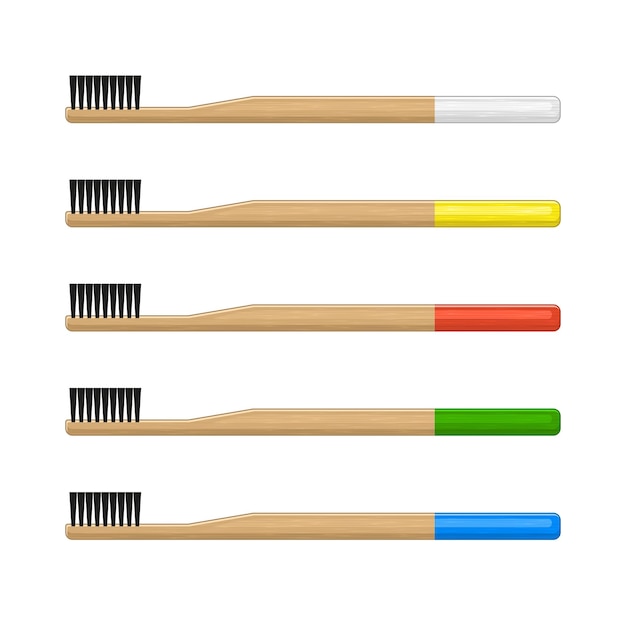
Locate an element on the screen. This screenshot has height=626, width=626. white paint is located at coordinates (486, 115).